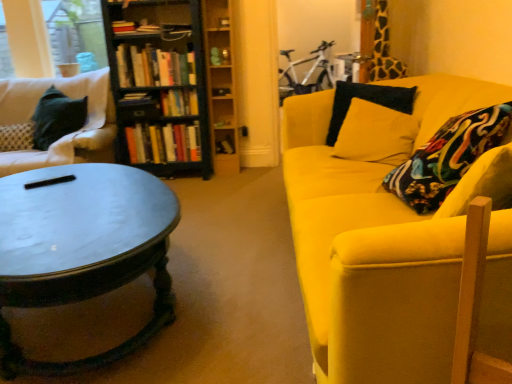
Where is `free space in front of black wood bookcase at left`? The width and height of the screenshot is (512, 384). free space in front of black wood bookcase at left is located at coordinates (199, 190).